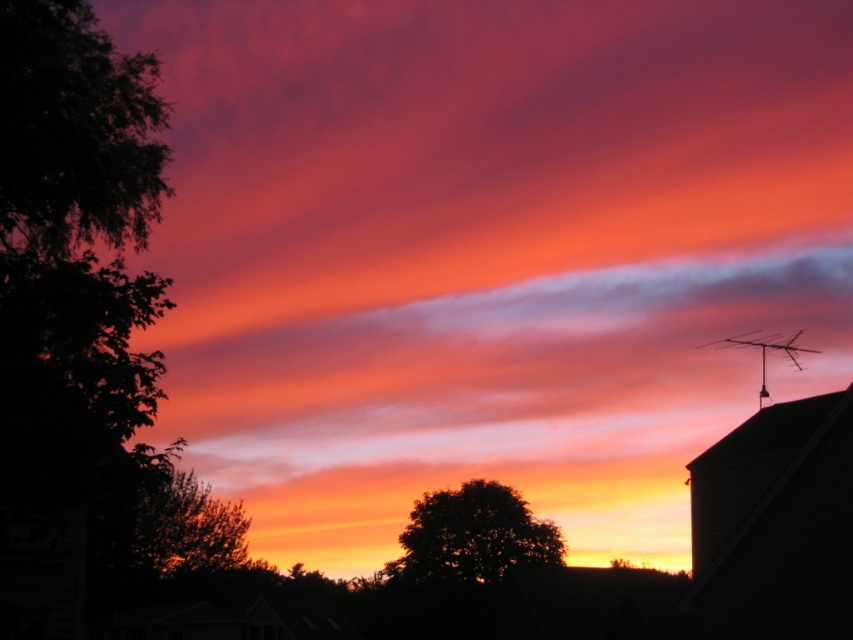
Question: Is dark green leafy tree at left to the left of silky orange tree at center from the viewer's perspective?

Choices:
 (A) no
 (B) yes

Answer: (A)

Question: Estimate the real-world distances between objects in this image. Which object is closer to the dark green leafy tree at center?

Choices:
 (A) dark green leafy tree at left
 (B) silky orange tree at center

Answer: (B)

Question: Does dark green leafy tree at center have a larger size compared to silky orange tree at center?

Choices:
 (A) yes
 (B) no

Answer: (B)

Question: Is dark green leafy tree at left behind dark green leafy tree at center?

Choices:
 (A) no
 (B) yes

Answer: (A)

Question: Which object is the farthest from the dark green leafy tree at center?

Choices:
 (A) silky orange tree at center
 (B) dark green leafy tree at left

Answer: (B)

Question: Which point is farther to the camera?

Choices:
 (A) silky orange tree at center
 (B) dark green leafy tree at left
 (C) dark green leafy tree at center

Answer: (C)